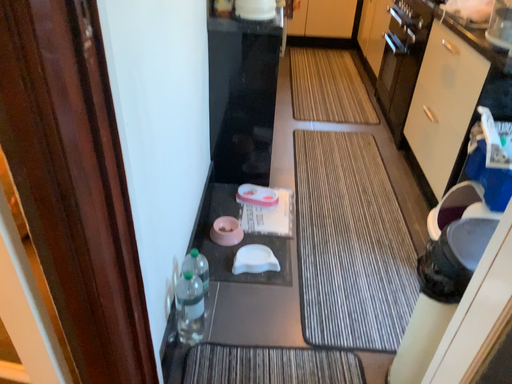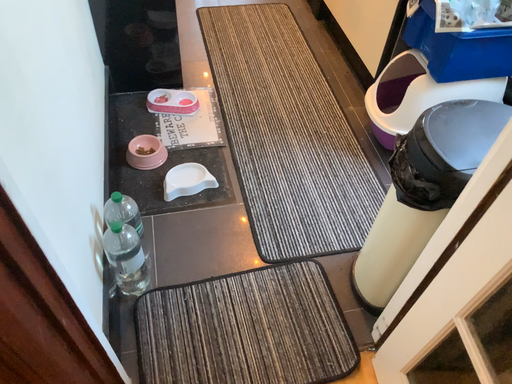
Question: Which way did the camera rotate in the video?

Choices:
 (A) rotated upward
 (B) rotated downward

Answer: (B)